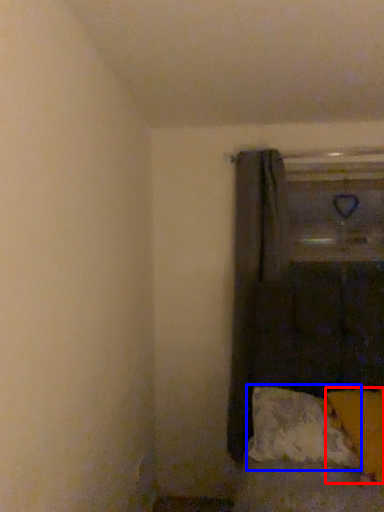
Question: Which object appears farthest to the camera in this image, pillow (highlighted by a red box) or pillow (highlighted by a blue box)?

Choices:
 (A) pillow
 (B) pillow

Answer: (B)